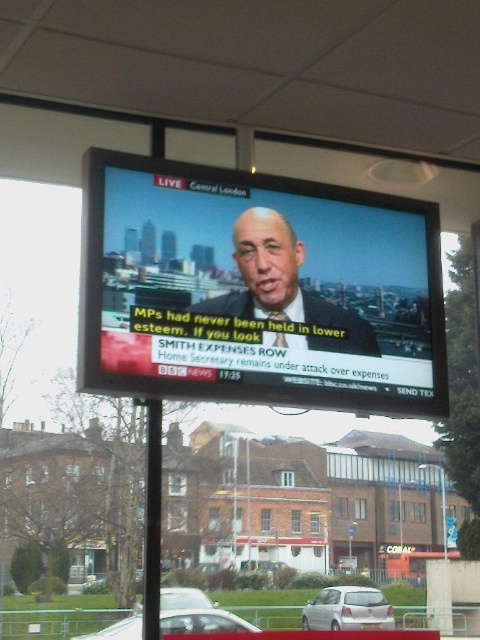
Can you confirm if matte black screen at center is positioned to the left of silver metallic hatchback at lower center?

Yes, matte black screen at center is to the left of silver metallic hatchback at lower center.

Where is `matte black screen at center`? The height and width of the screenshot is (640, 480). matte black screen at center is located at coordinates (257, 289).

Is point (180, 204) positioned before point (319, 618)?

Yes.

The height and width of the screenshot is (640, 480). I want to click on matte black screen at center, so click(257, 289).

Who is positioned more to the left, matte black screen at center or white matte car at lower center?

white matte car at lower center

Is matte black screen at center above white matte car at lower center?

Yes.

Who is more distant from viewer, (124, 260) or (173, 611)?

Positioned behind is point (173, 611).

Where is `matte black screen at center`? The width and height of the screenshot is (480, 640). matte black screen at center is located at coordinates (257, 289).

Which of these two, matte black screen at center or silver metallic car at center, stands shorter?

With less height is matte black screen at center.

Does matte black screen at center appear under silver metallic car at center?

No, matte black screen at center is not below silver metallic car at center.

Is point (430, 310) closer to camera compared to point (178, 604)?

Yes, point (430, 310) is closer to viewer.

Image resolution: width=480 pixels, height=640 pixels. In order to click on matte black screen at center in this screenshot , I will do `click(257, 289)`.